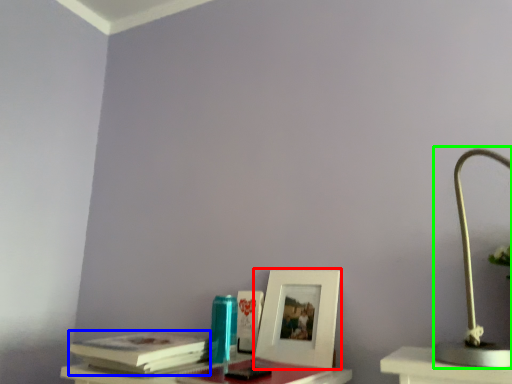
Question: Which object is positioned closest to picture frame (highlighted by a red box)? Select from paperback book (highlighted by a blue box) and lamp (highlighted by a green box).

Choices:
 (A) paperback book
 (B) lamp

Answer: (A)